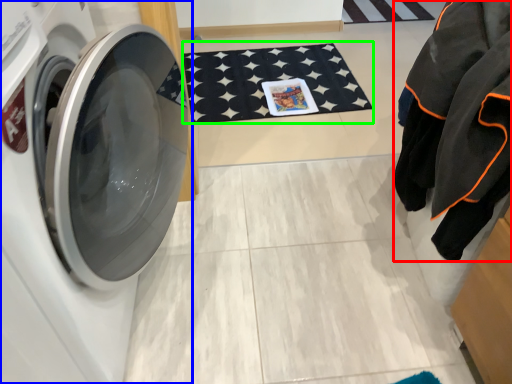
Question: Based on their relative distances, which object is farther from clothing (highlighted by a red box)? Choose from washing machine (highlighted by a blue box) and bath mat (highlighted by a green box).

Choices:
 (A) washing machine
 (B) bath mat

Answer: (B)